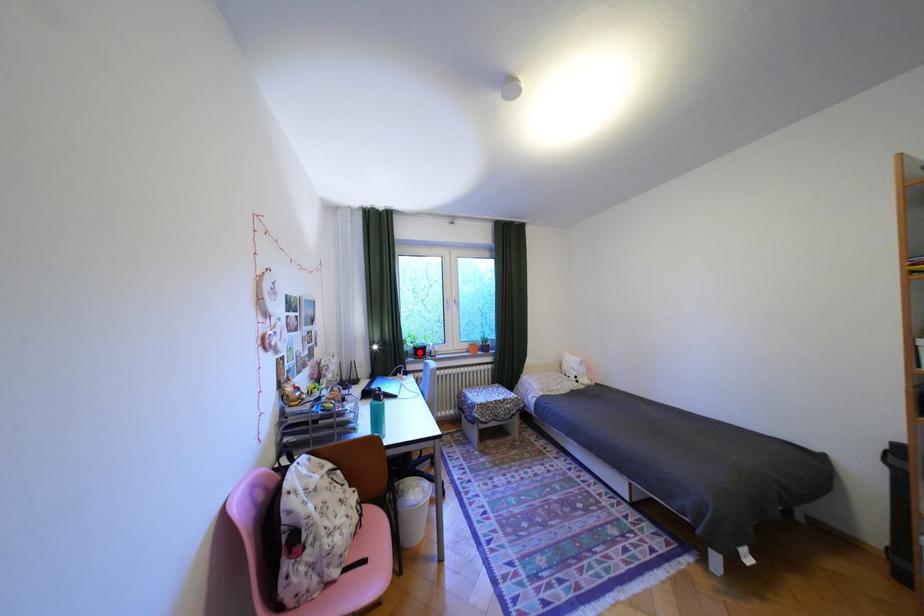
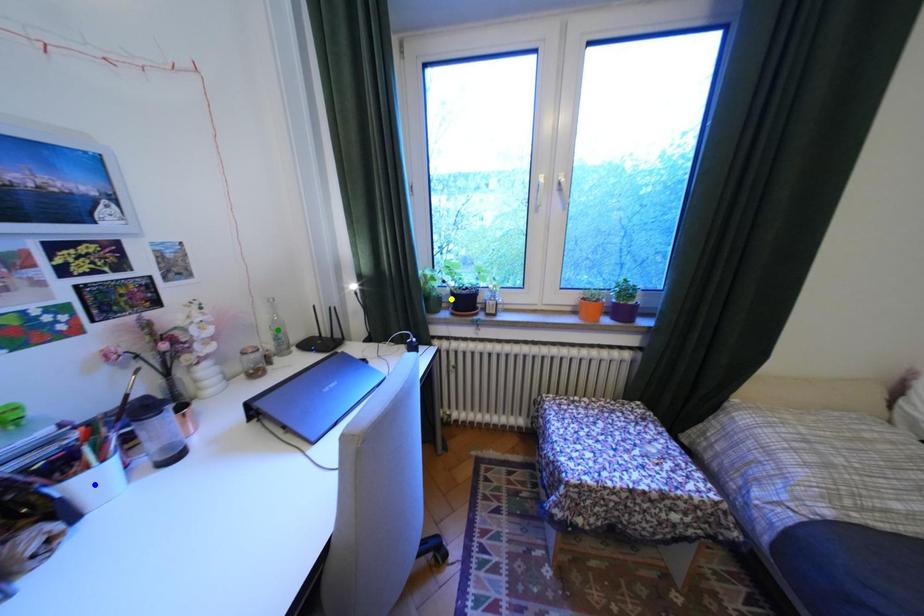
Question: I am providing you with two images of the same scene from different viewpoints. A red point is marked on the first image. You are given multiple points on the second image. In image 2, which mark is for the same physical point as the one in image 1?

Choices:
 (A) yellow point
 (B) green point
 (C) blue point

Answer: (A)